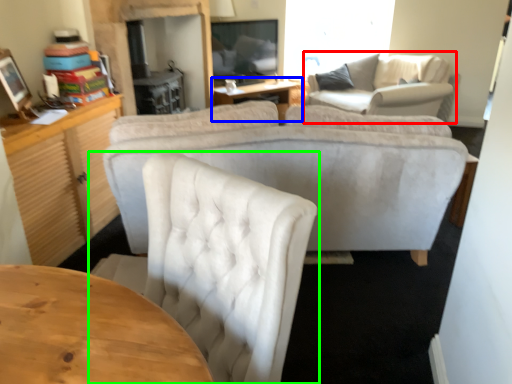
Question: Which object is the closest to the couch (highlighted by a red box)? Choose among these: table (highlighted by a blue box) or chair (highlighted by a green box).

Choices:
 (A) table
 (B) chair

Answer: (A)